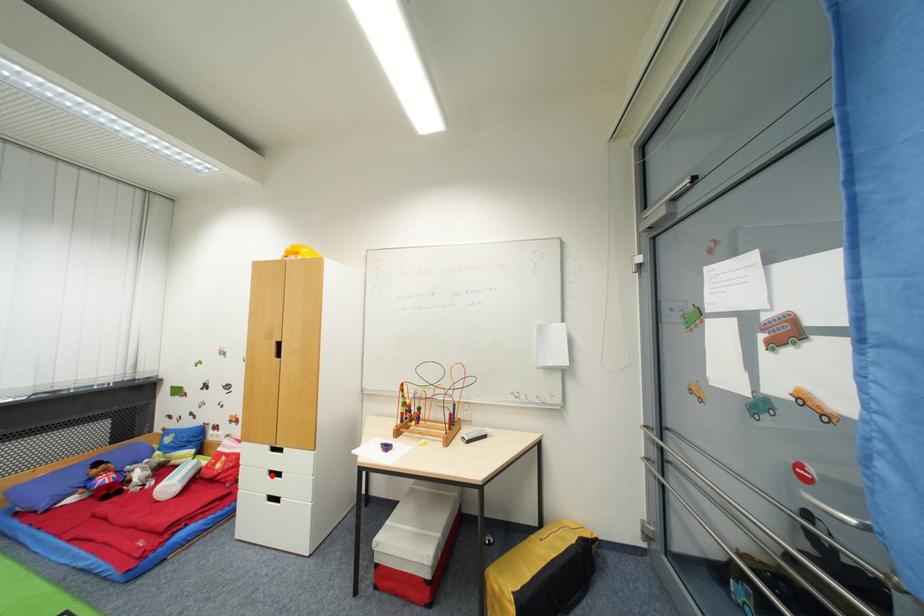
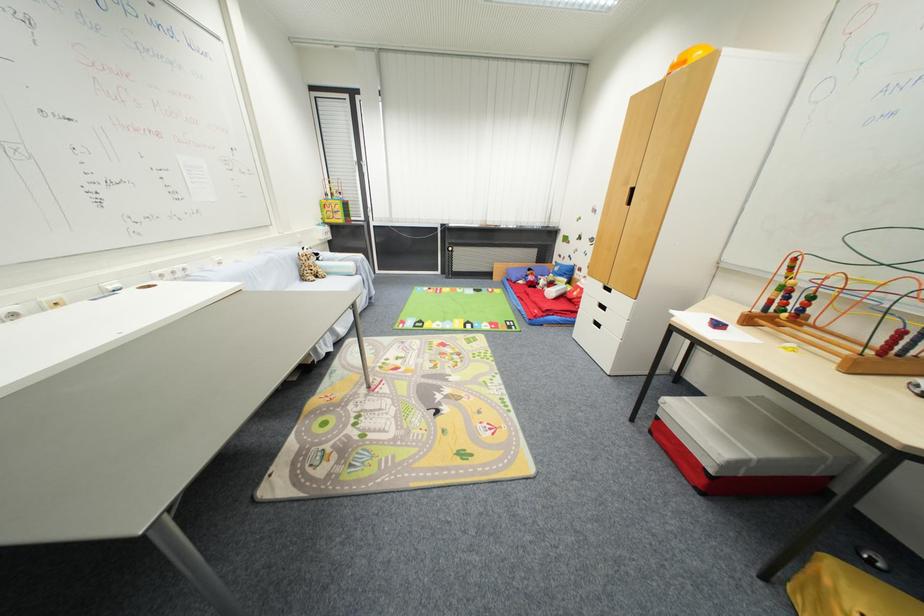
Question: I am providing you with two images of the same scene from different viewpoints. Image1 has a red point marked. In image2, the corresponding 3D location appears at what relative position? Reply with the corresponding letter.

Choices:
 (A) Closer
 (B) Farther

Answer: (A)